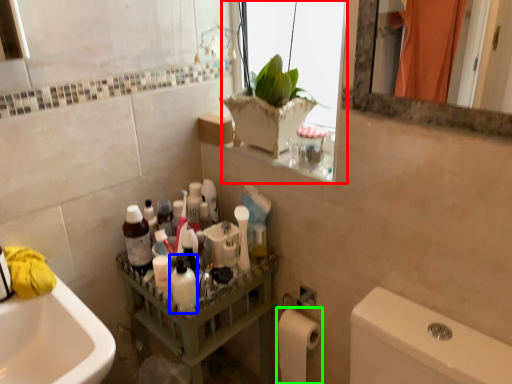
Question: Considering the real-world distances, which object is closest to window (highlighted by a red box)? mouthwash (highlighted by a blue box) or toilet paper (highlighted by a green box).

Choices:
 (A) mouthwash
 (B) toilet paper

Answer: (A)